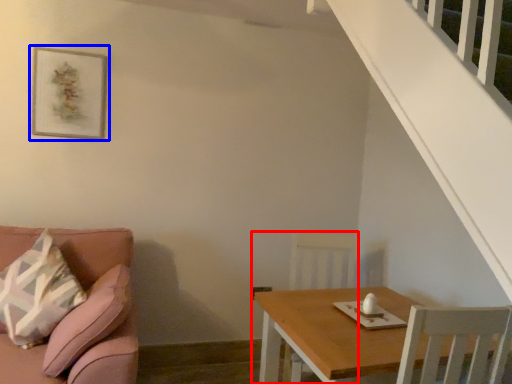
Question: Which point is closer to the camera, armchair (highlighted by a red box) or picture frame (highlighted by a blue box)?

Choices:
 (A) armchair
 (B) picture frame

Answer: (A)